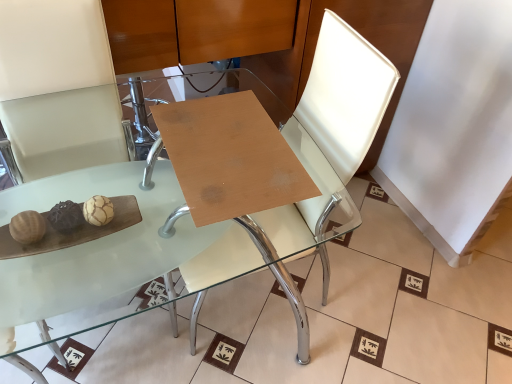
Question: From a real-world perspective, is wooden at center, the 1th table in the back-to-front sequence, positioned above or below transparent glass table at center, which ranks as the 2th table in back-to-front order?

Choices:
 (A) above
 (B) below

Answer: (A)

Question: Is wooden at center, the 1th table in the back-to-front sequence, in front of or behind transparent glass table at center, which ranks as the 2th table in back-to-front order, in the image?

Choices:
 (A) behind
 (B) front

Answer: (A)

Question: Based on their relative distances, which object is nearer to the wooden at center, the 1th table in the back-to-front sequence?

Choices:
 (A) transparent glass table at center, which ranks as the 2th table in back-to-front order
 (B) white leather swivel chair at center

Answer: (A)

Question: Considering the real-world distances, which object is closest to the white leather swivel chair at center?

Choices:
 (A) transparent glass table at center, which ranks as the 2th table in back-to-front order
 (B) wooden at center, the 1th table in the back-to-front sequence

Answer: (A)